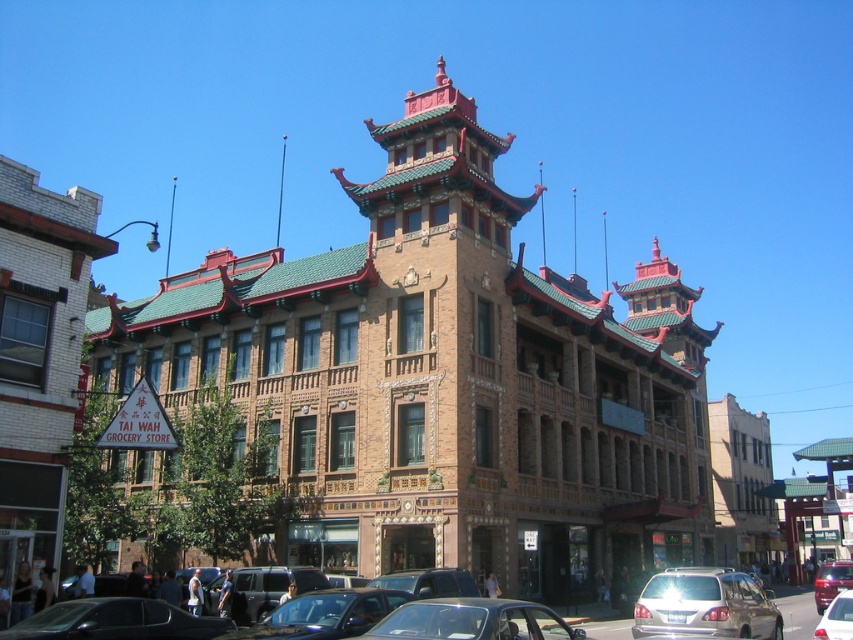
Can you confirm if brown brick building at center is bigger than shiny silver car at center?

Yes.

Can you confirm if brown brick building at center is positioned below shiny silver car at center?

Actually, brown brick building at center is above shiny silver car at center.

Between point (347, 323) and point (822, 564), which one is positioned in front?

Point (347, 323)

Where is `brown brick building at center`? This screenshot has height=640, width=853. brown brick building at center is located at coordinates (445, 380).

Does silver metallic station wagon at center lie behind metallic silver car at lower right?

Yes, silver metallic station wagon at center is behind metallic silver car at lower right.

Does point (717, 582) come closer to viewer compared to point (848, 611)?

No, it is behind (848, 611).

Locate an element on the screen. silver metallic station wagon at center is located at coordinates (705, 605).

The width and height of the screenshot is (853, 640). I want to click on silver metallic station wagon at center, so click(x=705, y=605).

Between silver metallic station wagon at center and metallic silver car at center, which one has more height?

silver metallic station wagon at center is taller.

Is silver metallic station wagon at center to the right of metallic silver car at center from the viewer's perspective?

Yes, silver metallic station wagon at center is to the right of metallic silver car at center.

I want to click on silver metallic station wagon at center, so click(x=705, y=605).

Find the location of a particular element. silver metallic station wagon at center is located at coordinates (705, 605).